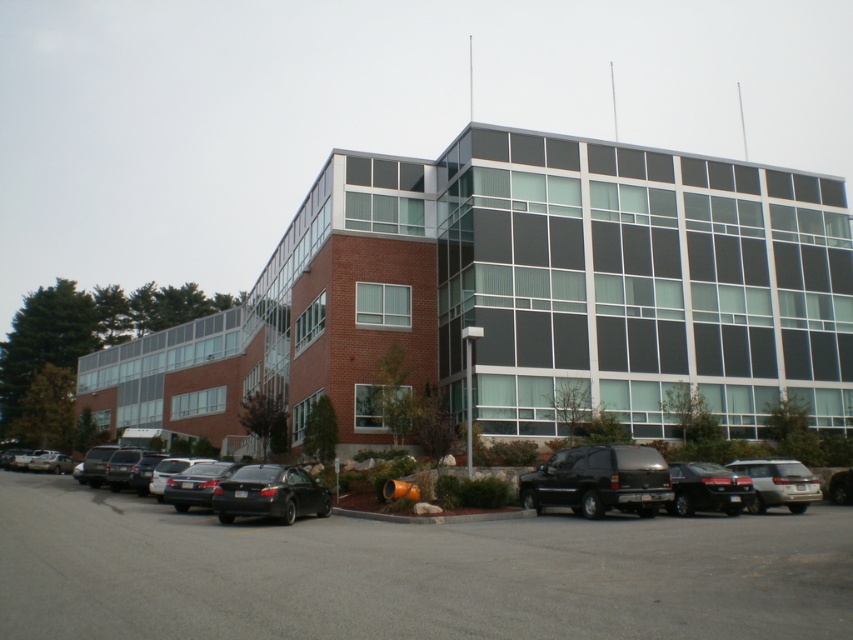
Question: Does gray asphalt parking lot at lower center have a larger size compared to glossy black sedan at lower left?

Choices:
 (A) yes
 (B) no

Answer: (A)

Question: Which of the following is the closest to the observer?

Choices:
 (A) (311, 490)
 (B) (631, 456)

Answer: (B)

Question: Among these points, which one is nearest to the camera?

Choices:
 (A) (688, 472)
 (B) (782, 468)
 (C) (114, 637)

Answer: (C)

Question: Does glossy black sedan at lower left appear on the left side of satin silver suv at lower right?

Choices:
 (A) yes
 (B) no

Answer: (A)

Question: Is satin black suv at center wider than satin black sedan at center?

Choices:
 (A) yes
 (B) no

Answer: (B)

Question: Which object is the farthest from the black matte suv at center?

Choices:
 (A) satin black sedan at center
 (B) satin black suv at center
 (C) glossy black sedan at lower left

Answer: (A)